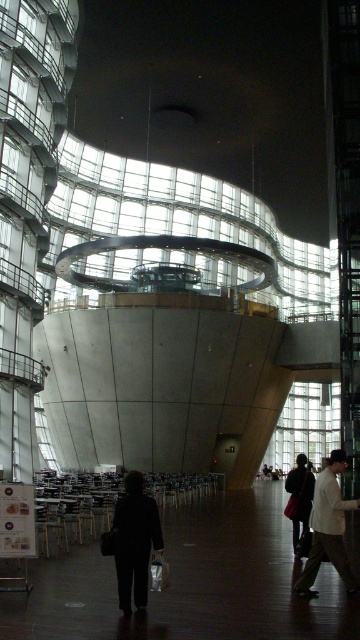
Question: Where is dark matte coat at center located in relation to light beige jacket at lower right in the image?

Choices:
 (A) above
 (B) below

Answer: (B)

Question: Among these points, which one is nearest to the camera?

Choices:
 (A) (330, 563)
 (B) (285, 513)

Answer: (A)

Question: Which point is farther from the camera taking this photo?

Choices:
 (A) [309, 484]
 (B) [115, 515]
 (C) [315, 518]

Answer: (A)

Question: Does dark matte coat at center appear over light beige jacket at lower right?

Choices:
 (A) no
 (B) yes

Answer: (A)

Question: Which point is closer to the camera taking this photo?

Choices:
 (A) (322, 548)
 (B) (140, 536)
 (C) (294, 552)

Answer: (B)

Question: Does light beige jacket at lower right appear on the left side of matte black jacket at center?

Choices:
 (A) yes
 (B) no

Answer: (A)